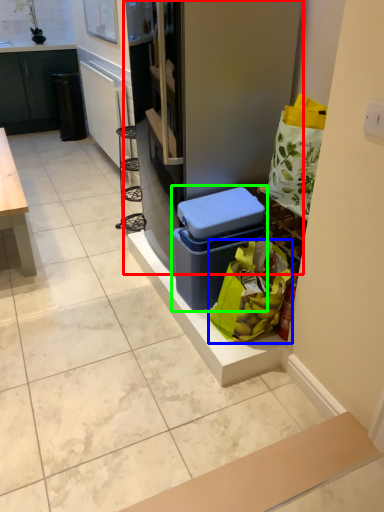
Question: Considering the real-world distances, which object is farthest from fridge (highlighted by a red box)? shopping bag (highlighted by a blue box) or storage box (highlighted by a green box)?

Choices:
 (A) shopping bag
 (B) storage box

Answer: (A)